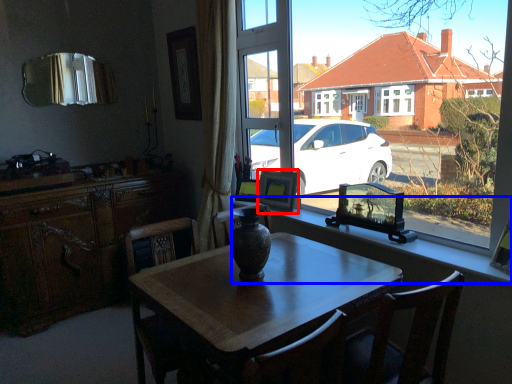
Question: Which point is closer to the camera, picture frame (highlighted by a red box) or window sill (highlighted by a blue box)?

Choices:
 (A) picture frame
 (B) window sill

Answer: (B)